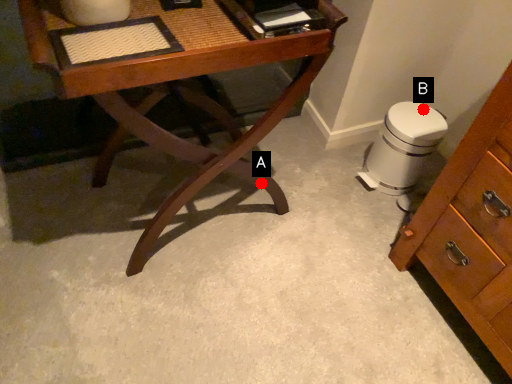
Question: Two points are circled on the image, labeled by A and B beside each circle. Which point appears closest to the camera in this image?

Choices:
 (A) A is closer
 (B) B is closer

Answer: (A)